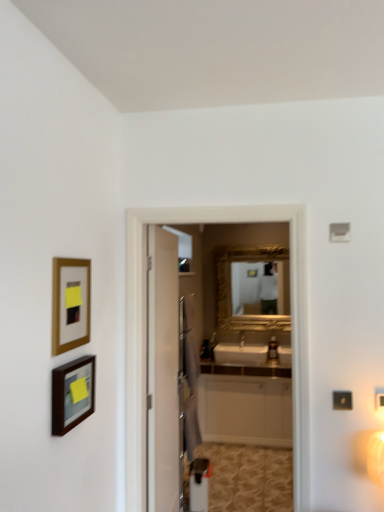
Question: From a real-world perspective, is white glossy screen door at center positioned above or below matte black picture frame at lower left, arranged as the first picture frame when ordered from the bottom?

Choices:
 (A) below
 (B) above

Answer: (B)

Question: From the image's perspective, relative to matte black picture frame at lower left, arranged as the first picture frame when ordered from the bottom, is white glossy screen door at center above or below?

Choices:
 (A) above
 (B) below

Answer: (B)

Question: Which object is positioned farthest from the gold-framed picture at left, which is counted as the 1th picture frame, starting from the top?

Choices:
 (A) white glossy screen door at center
 (B) matte black picture frame at lower left, which ranks as the 2th picture frame in top-to-bottom order
 (C) white glossy cabinet at center

Answer: (C)

Question: Which object is positioned farthest from the matte black picture frame at lower left, arranged as the first picture frame when ordered from the bottom?

Choices:
 (A) white glossy cabinet at center
 (B) gold-framed picture at left, which is counted as the 2th picture frame, starting from the bottom
 (C) white glossy screen door at center

Answer: (A)